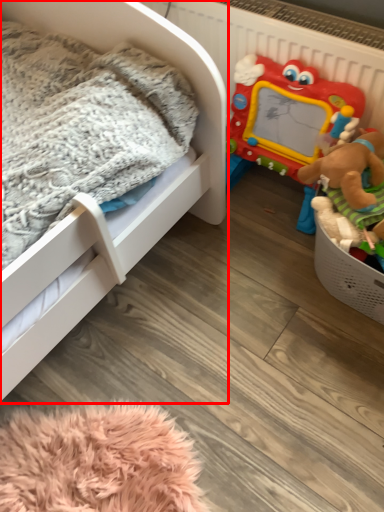
Question: From the image's perspective, what is the correct spatial relationship of infant bed (annotated by the red box) in relation to toy?

Choices:
 (A) below
 (B) above

Answer: (A)